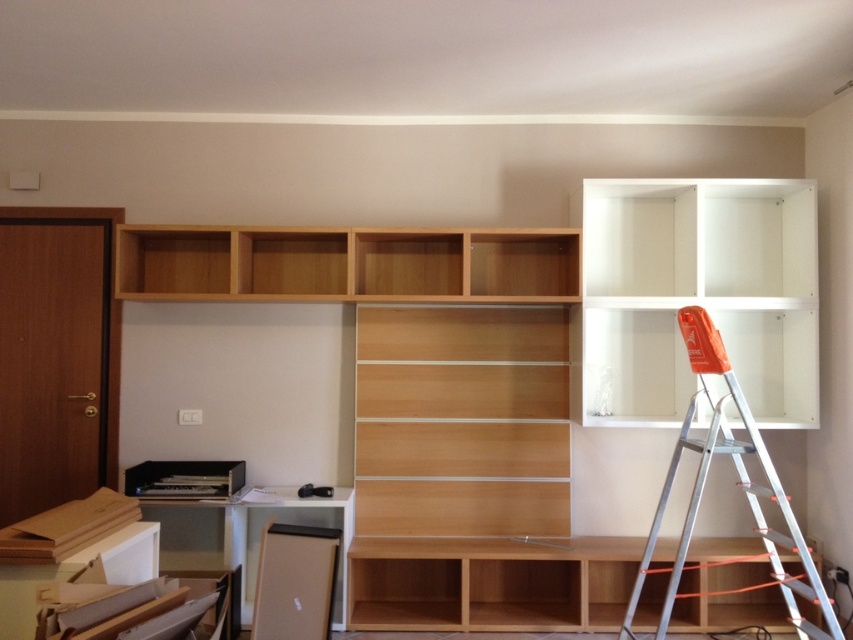
You are organizing the items on the light wood shelf at center and the light wood shelves at center. Since you have limited space, which one can accommodate a larger item?

The light wood shelf at center can accommodate a larger item because it is larger in size than the light wood shelves at center.

You are organizing a small library in the room and need to place a large dictionary and a stack of magazines. The light wood bookshelf at center and the light wood shelves at center are available. Which one should you choose for the dictionary and which for the magazines based on their sizes?

The light wood bookshelf at center has a larger size compared to light wood shelves at center, so the large dictionary should be placed on the light wood bookshelf at center and the stack of magazines on the light wood shelves at center.

Please provide the 2D coordinates of the light wood bookshelf at center in the image.

The light wood bookshelf at center is located at coordinates (523, 362).